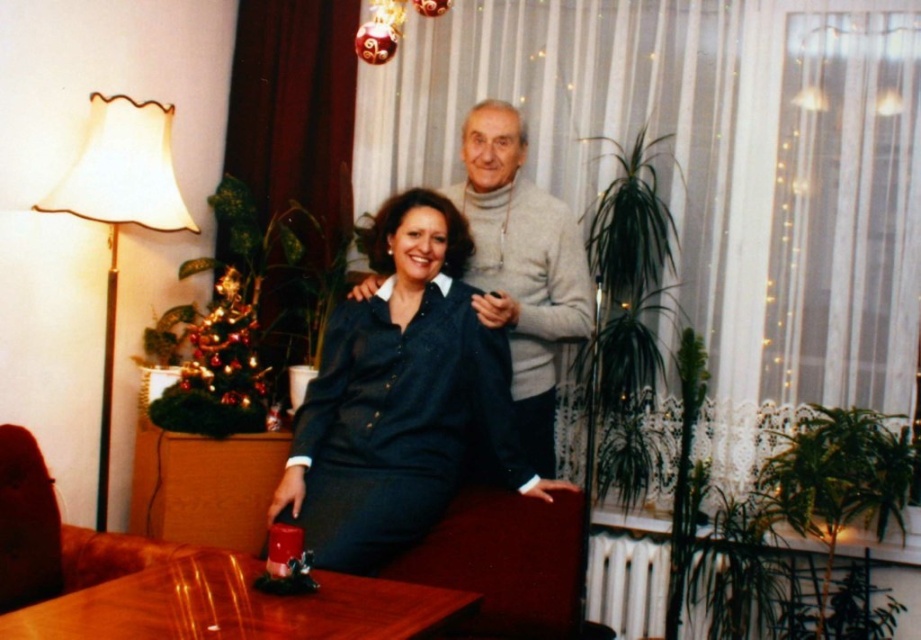
Measure the distance between light gray turtleneck sweater at center and brown leather armchair at lower left.

light gray turtleneck sweater at center is 3.83 feet from brown leather armchair at lower left.

Does light gray turtleneck sweater at center appear on the left side of brown leather armchair at lower left?

Incorrect, light gray turtleneck sweater at center is not on the left side of brown leather armchair at lower left.

Find the location of a particular element. The image size is (921, 640). light gray turtleneck sweater at center is located at coordinates (521, 266).

Is point (472, 410) behind point (249, 406)?

No, (472, 410) is closer to viewer.

Describe the element at coordinates (401, 397) in the screenshot. I see `denim shirt at center` at that location.

Between point (492, 388) and point (178, 413), which one is positioned behind?

The point (178, 413) is more distant.

This screenshot has height=640, width=921. Identify the location of denim shirt at center. (401, 397).

Who is higher up, light gray turtleneck sweater at center or glossy wood table at lower center?

light gray turtleneck sweater at center

Based on the photo, can you confirm if light gray turtleneck sweater at center is wider than glossy wood table at lower center?

In fact, light gray turtleneck sweater at center might be narrower than glossy wood table at lower center.

Measure the distance between light gray turtleneck sweater at center and camera.

light gray turtleneck sweater at center is 2.30 meters from camera.

The width and height of the screenshot is (921, 640). I want to click on light gray turtleneck sweater at center, so click(x=521, y=266).